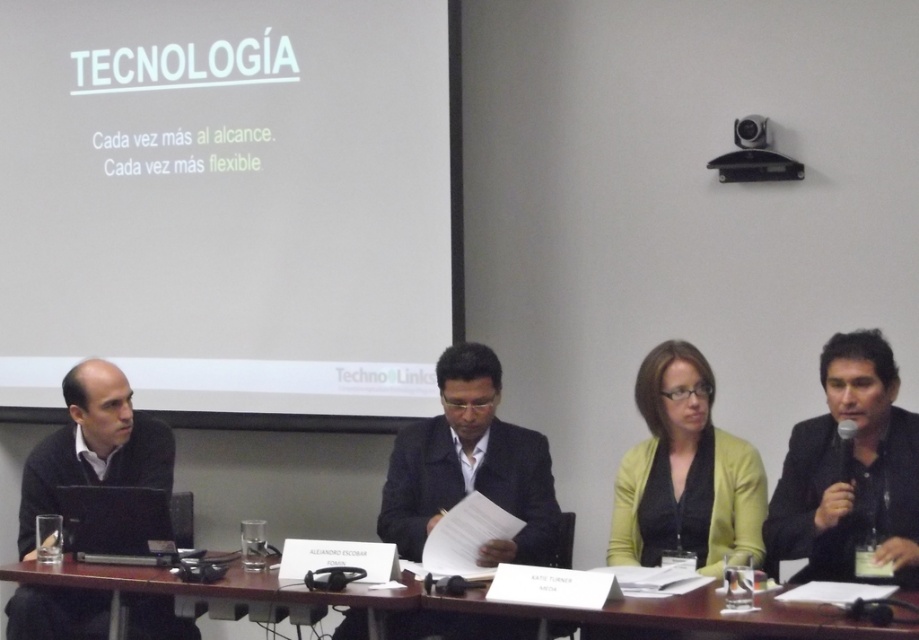
Question: Which object is the closest to the white paper at center?

Choices:
 (A) matte green cardigan at center
 (B) black plastic camera at upper right

Answer: (A)

Question: Which point is farther from the camera taking this photo?

Choices:
 (A) (437, 486)
 (B) (293, 618)

Answer: (A)

Question: Does black matte jacket at right have a smaller size compared to black plastic camera at upper right?

Choices:
 (A) yes
 (B) no

Answer: (B)

Question: Where is white paper at center located in relation to brown wood table at center in the image?

Choices:
 (A) right
 (B) left

Answer: (A)

Question: Which object is the closest to the black matte sweater at left?

Choices:
 (A) brown wood table at center
 (B) matte green cardigan at center
 (C) white paper at center

Answer: (A)

Question: Is brown wood table at center positioned before black matte laptop at left?

Choices:
 (A) no
 (B) yes

Answer: (B)